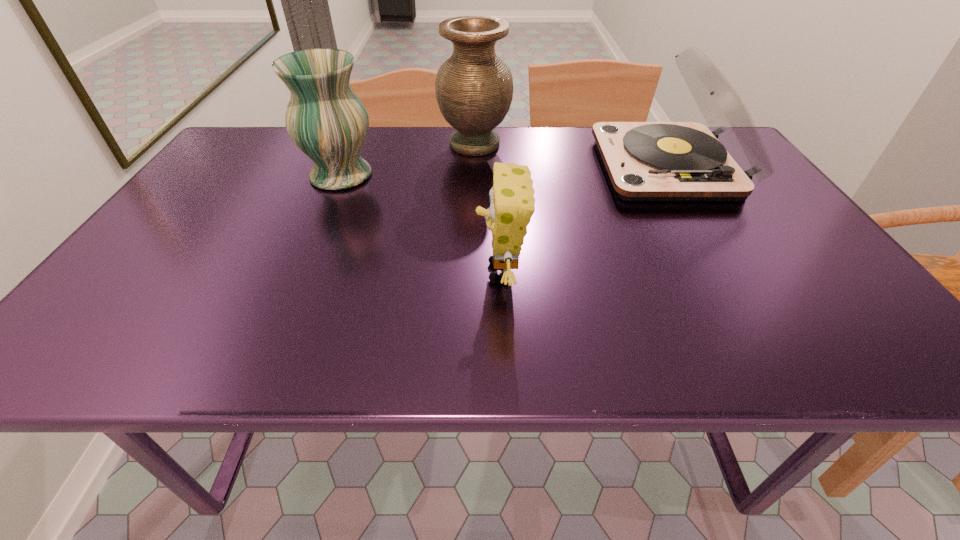
In order to click on the right vase in this screenshot , I will do point(474,88).

Identify the location of record player. Image resolution: width=960 pixels, height=540 pixels. (646, 161).

In order to click on the leftmost object in this screenshot , I will do `click(327, 121)`.

Where is `the shortest object`? Image resolution: width=960 pixels, height=540 pixels. the shortest object is located at coordinates (512, 204).

Find the location of a particular element. This screenshot has width=960, height=540. the nearest object is located at coordinates (512, 204).

At what (x,y) coordinates should I click in order to perform the action: click on vacant area situated on the front of the right vase. Please return your answer as a coordinate pair (x, y). Looking at the image, I should click on (473, 243).

You are a GUI agent. You are given a task and a screenshot of the screen. Output one action in this format:
    pyautogui.click(x=<x>, y=<y>)
    Task: Click on the free location located 0.150m with the tonearm facing the front of the record player
    This screenshot has height=540, width=960.
    Given the screenshot: What is the action you would take?
    pyautogui.click(x=545, y=166)

What are the coordinates of `blank space located with the tonearm facing the front of the record player` in the screenshot? It's located at click(541, 166).

I want to click on vacant point located with the tonearm facing the front of the record player, so click(575, 166).

Identify the location of free location located 0.130m on the back of the leftmost object. (358, 135).